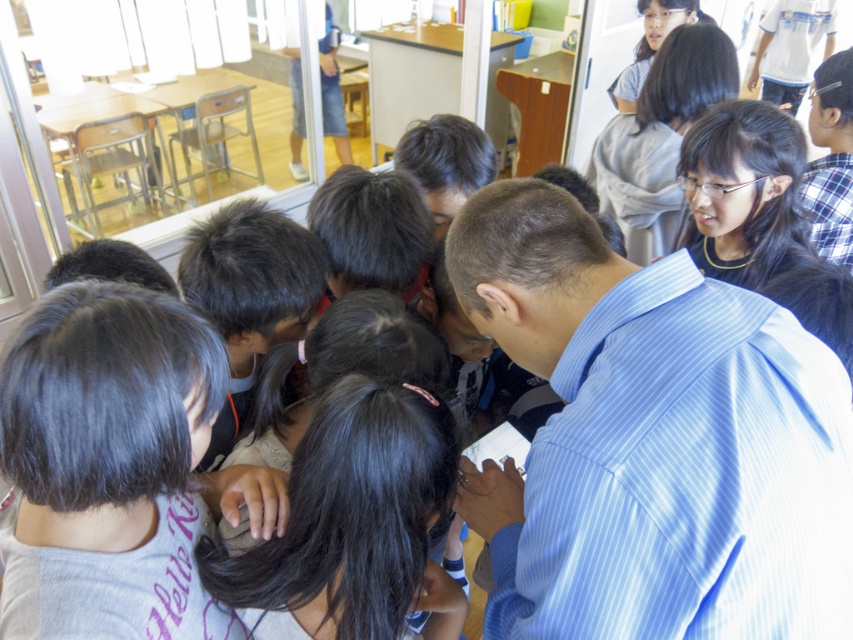
Looking at this image, you are a teacher in the classroom. You notice a child with dark gray hair at center. Where exactly is this child located in the room?

The child with dark gray hair at center is located at point [108,465] in the room.

You are a teacher observing the children in the classroom through the glass partition. You notice a point marked at coordinates [108,465]. What does this point represent?

The point at coordinates [108,465] corresponds to the dark gray hair at center.